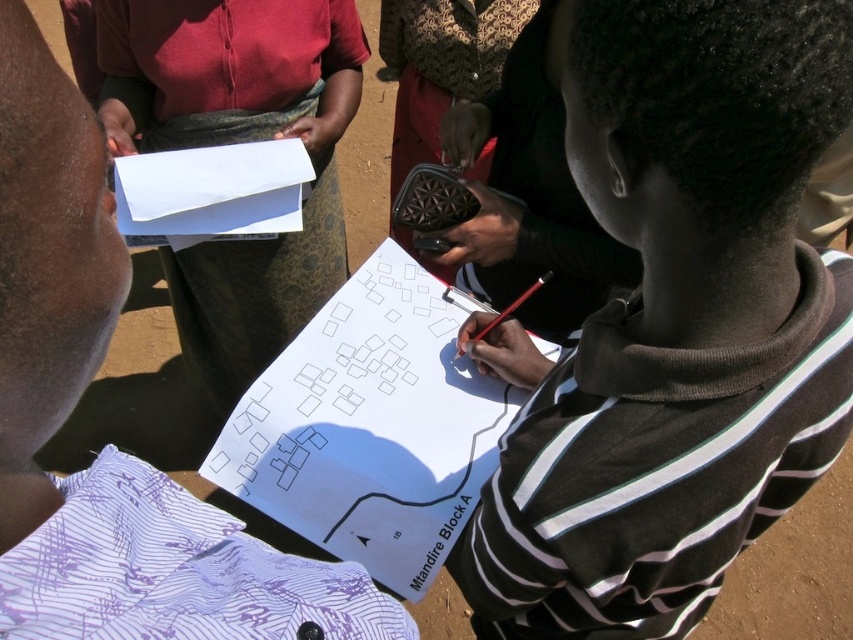
Based on the photo, you are standing at the point labeled as point (674, 324) in the image. What is the nearest object to you?

The point (674, 324) corresponds to the black striped hoodie at center, so the nearest object to you is the black striped hoodie at center.